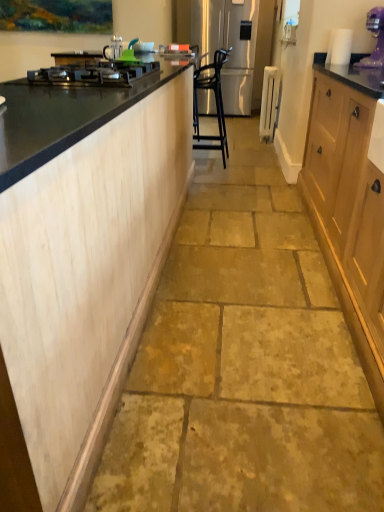
Question: From the image's perspective, is light wood cabinetry at left on top of black glass cooktop at left?

Choices:
 (A) yes
 (B) no

Answer: (B)

Question: Can you confirm if light wood cabinetry at left is positioned to the right of black glass cooktop at left?

Choices:
 (A) no
 (B) yes

Answer: (B)

Question: Is light wood cabinetry at left oriented away from black glass cooktop at left?

Choices:
 (A) yes
 (B) no

Answer: (B)

Question: From a real-world perspective, does light wood cabinetry at left sit lower than black glass cooktop at left?

Choices:
 (A) no
 (B) yes

Answer: (B)

Question: From a real-world perspective, is light wood cabinetry at left on black glass cooktop at left?

Choices:
 (A) no
 (B) yes

Answer: (A)

Question: Is light wood cabinetry at left in contact with black glass cooktop at left?

Choices:
 (A) no
 (B) yes

Answer: (A)

Question: Considering the relative sizes of purple plastic blender at upper right and satin silver refrigerator at center in the image provided, is purple plastic blender at upper right taller than satin silver refrigerator at center?

Choices:
 (A) no
 (B) yes

Answer: (A)

Question: Is purple plastic blender at upper right positioned before satin silver refrigerator at center?

Choices:
 (A) no
 (B) yes

Answer: (B)

Question: Is purple plastic blender at upper right next to satin silver refrigerator at center and touching it?

Choices:
 (A) no
 (B) yes

Answer: (A)

Question: From a real-world perspective, is purple plastic blender at upper right under satin silver refrigerator at center?

Choices:
 (A) yes
 (B) no

Answer: (B)

Question: Does purple plastic blender at upper right appear on the right side of satin silver refrigerator at center?

Choices:
 (A) yes
 (B) no

Answer: (A)

Question: Is purple plastic blender at upper right positioned beyond the bounds of satin silver refrigerator at center?

Choices:
 (A) yes
 (B) no

Answer: (A)

Question: Is satin silver refrigerator at center oriented away from purple plastic blender at upper right?

Choices:
 (A) yes
 (B) no

Answer: (B)